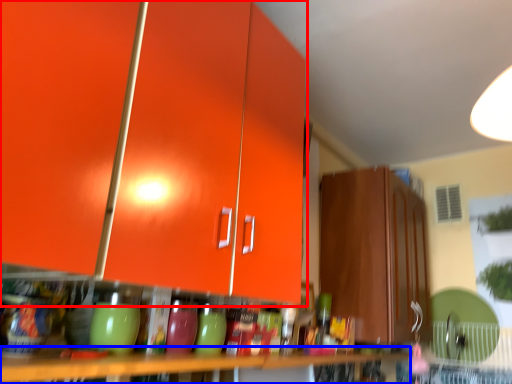
Question: Which object appears closest to the camera in this image, cabinetry (highlighted by a red box) or table (highlighted by a blue box)?

Choices:
 (A) cabinetry
 (B) table

Answer: (A)